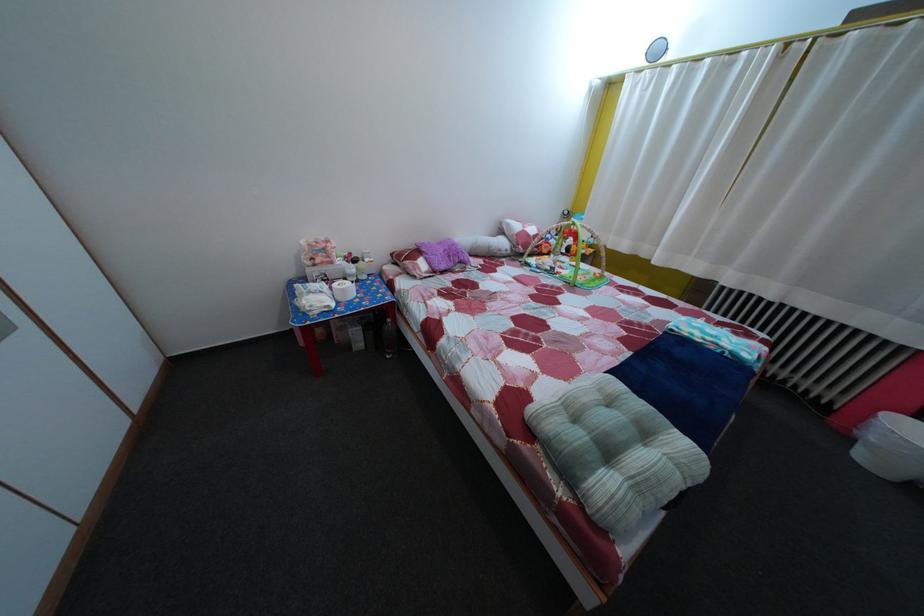
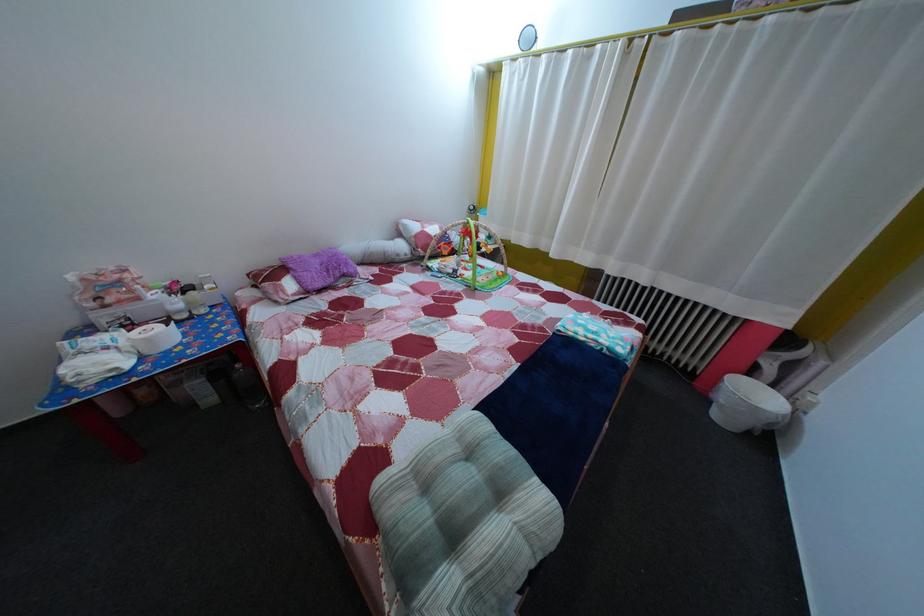
Where in the second image is the point corresponding to the point at 377,268 from the first image?

(216, 294)